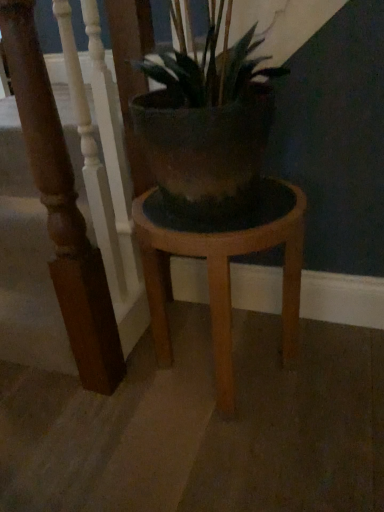
Question: From the image's perspective, is wooden stool at center positioned above or below wooden stair rail at left?

Choices:
 (A) below
 (B) above

Answer: (A)

Question: From a real-world perspective, is wooden stool at center physically located above or below wooden stair rail at left?

Choices:
 (A) below
 (B) above

Answer: (A)

Question: Considering the positions of point (221, 231) and point (84, 309), is point (221, 231) closer or farther from the camera than point (84, 309)?

Choices:
 (A) farther
 (B) closer

Answer: (B)

Question: From the image's perspective, relative to wooden stool at center, is wooden stair rail at left above or below?

Choices:
 (A) above
 (B) below

Answer: (A)

Question: From their relative heights in the image, would you say wooden stair rail at left is taller or shorter than wooden stool at center?

Choices:
 (A) short
 (B) tall

Answer: (B)

Question: Is point (46, 90) positioned closer to the camera than point (160, 209)?

Choices:
 (A) farther
 (B) closer

Answer: (B)

Question: Is wooden stair rail at left in front of or behind wooden stool at center in the image?

Choices:
 (A) behind
 (B) front

Answer: (B)